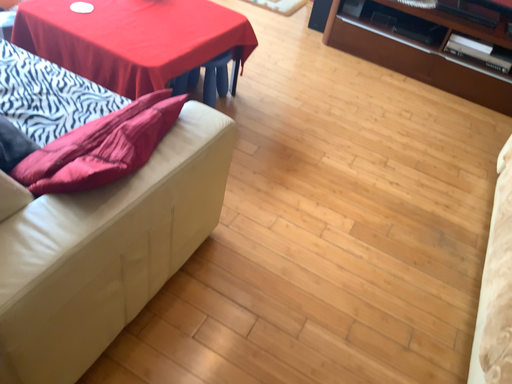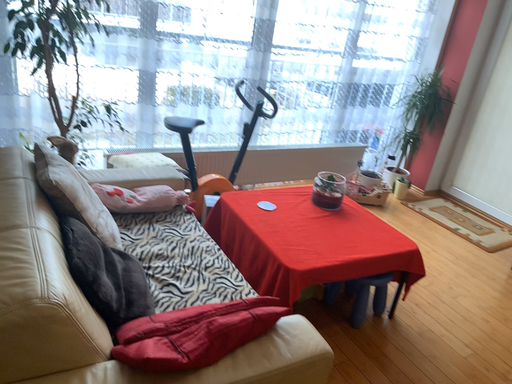
Question: How did the camera likely rotate when shooting the video?

Choices:
 (A) rotated upward
 (B) rotated downward

Answer: (A)